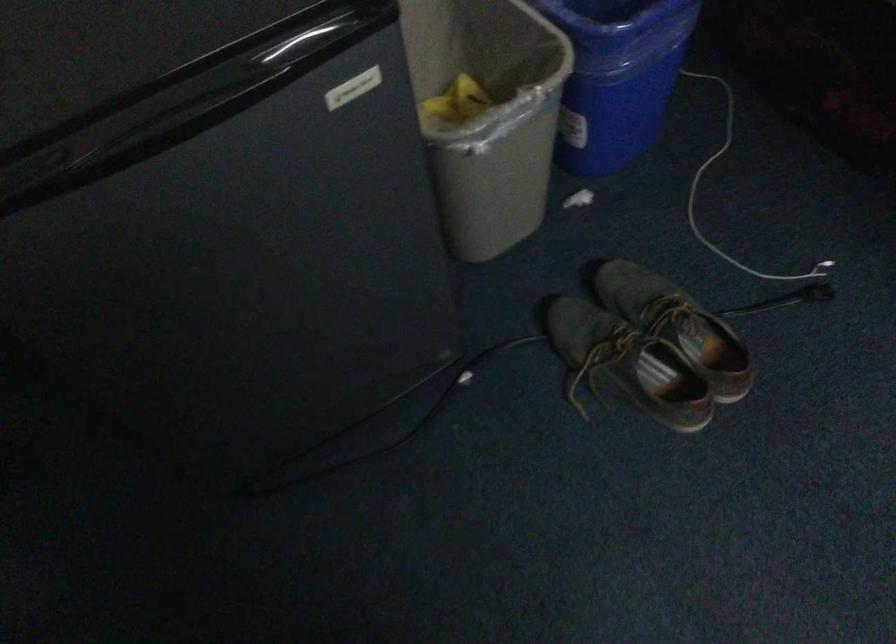
The image size is (896, 644). Identify the location of white cable connector. (734, 196).